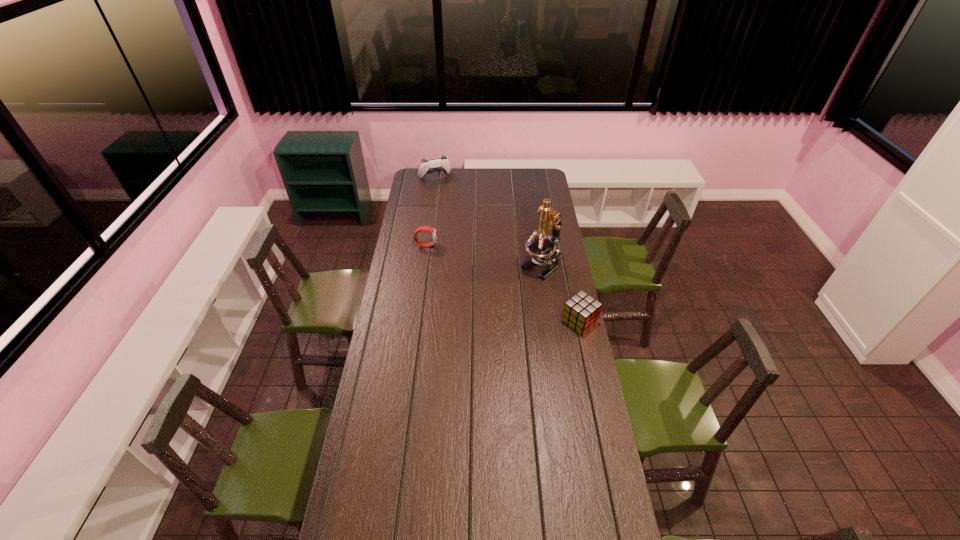
The image size is (960, 540). In the image, there is a desktop. In order to click on free space at the left edge in this screenshot , I will do `click(369, 415)`.

The width and height of the screenshot is (960, 540). I want to click on vacant space at the right edge of the desktop, so click(596, 480).

Find the location of a particular element. The width and height of the screenshot is (960, 540). free spot between the cube and the control is located at coordinates (507, 249).

Find the location of a particular element. free spot between the nearest object and the third nearest object is located at coordinates (503, 283).

Identify the location of unoccupied area between the cube and the farthest object. The height and width of the screenshot is (540, 960). (507, 249).

Find the location of a particular element. The width and height of the screenshot is (960, 540). vacant area that lies between the watch and the cube is located at coordinates (503, 283).

The height and width of the screenshot is (540, 960). What are the coordinates of `empty space that is in between the farthest object and the watch` in the screenshot? It's located at (430, 211).

Locate an element on the screen. free area in between the control and the second nearest object is located at coordinates (489, 221).

I want to click on unoccupied area between the farthest object and the second nearest object, so click(x=489, y=221).

Identify the location of empty location between the second nearest object and the third nearest object. (485, 255).